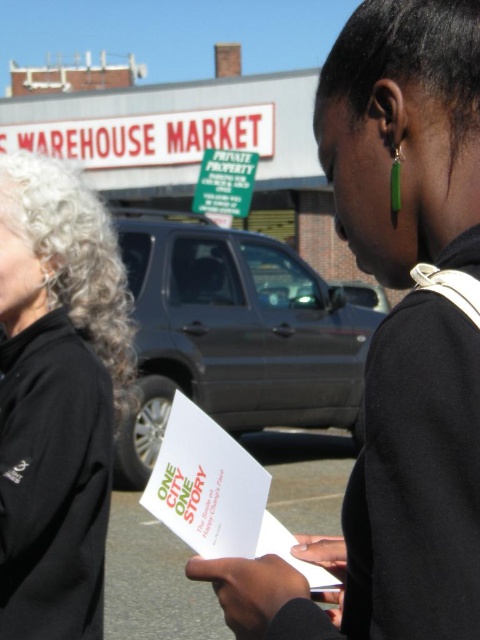
You are a delivery person who needs to place a matte black paper at center on a shelf next to the black fleece jacket at left. If the shelf has a height limit of 10 inches, can both items be placed there?

The matte black paper at center is not as tall as the black fleece jacket at left. Since the shelf has a height limit of 10 inches, both items can be placed there only if the tallest item, the black fleece jacket at left, is under 10 inches in height. However, without knowing the exact height of the jacket, we cannot confirm if both will fit.